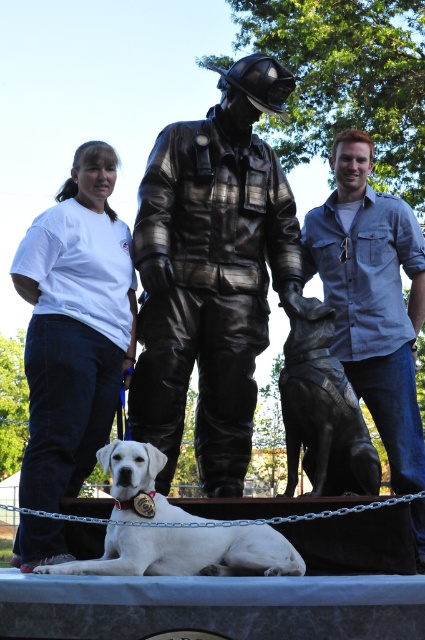
Question: Which of the following is the closest to the observer?

Choices:
 (A) shiny black dog at center
 (B) white fur dog at lower center

Answer: (B)

Question: Considering the relative positions of bronze statue of firefighter at center and blue denim shirt at right in the image provided, where is bronze statue of firefighter at center located with respect to blue denim shirt at right?

Choices:
 (A) below
 (B) above

Answer: (B)

Question: Which point is farther from the camera taking this photo?

Choices:
 (A) (254, 536)
 (B) (317, 368)
 (C) (359, 372)

Answer: (C)

Question: Does bronze statue of firefighter at center have a larger size compared to white fur dog at lower center?

Choices:
 (A) no
 (B) yes

Answer: (B)

Question: Can you confirm if bronze statue of firefighter at center is wider than white cotton shirt at left?

Choices:
 (A) yes
 (B) no

Answer: (A)

Question: Which object is farther from the camera taking this photo?

Choices:
 (A) shiny black dog at center
 (B) blue denim shirt at right
 (C) white cotton shirt at left
 (D) bronze statue of firefighter at center

Answer: (D)